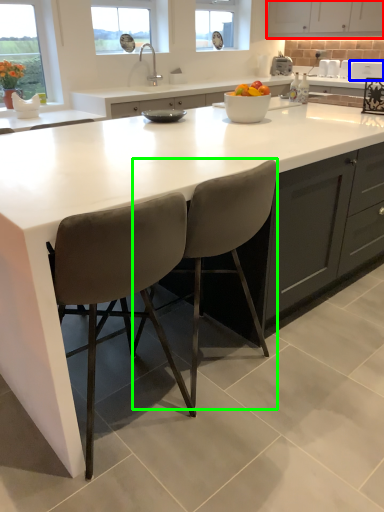
Question: Which is nearer to the cabinetry (highlighted by a red box)? appliance (highlighted by a blue box) or chair (highlighted by a green box).

Choices:
 (A) appliance
 (B) chair

Answer: (A)